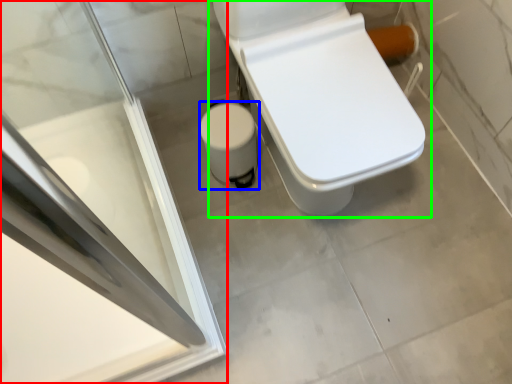
Question: Which is nearer to the screen door (highlighted by a red box)? potty (highlighted by a blue box) or toilet (highlighted by a green box).

Choices:
 (A) potty
 (B) toilet

Answer: (A)